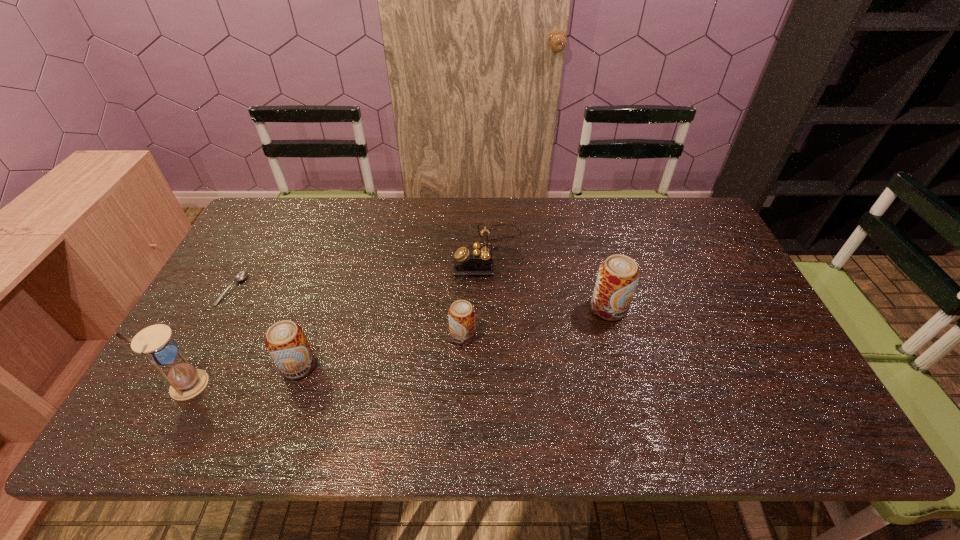
Locate an element on the screen. beer can that is the second closest to the fourth object from right to left is located at coordinates click(618, 275).

What are the coordinates of `vacant space that satisfies the following two spatial constraints: 1. on the back side of the fifth shortest object; 2. on the left side of the tallest object` in the screenshot? It's located at (227, 308).

Identify the location of free region that satisfies the following two spatial constraints: 1. on the back side of the rightmost object; 2. on the dial of the telephone. point(593,252).

Identify the location of free space that satisfies the following two spatial constraints: 1. on the dial of the telephone; 2. on the right side of the rightmost beer can. The width and height of the screenshot is (960, 540). (491, 308).

Identify the location of vacant region that satisfies the following two spatial constraints: 1. on the back side of the fourth object from right to left; 2. on the left side of the rightmost beer can. (319, 308).

Where is `free region that satisfies the following two spatial constraints: 1. on the dial of the telephone; 2. on the left side of the farthest beer can`? free region that satisfies the following two spatial constraints: 1. on the dial of the telephone; 2. on the left side of the farthest beer can is located at coordinates (491, 308).

What are the coordinates of `free location that satisfies the following two spatial constraints: 1. on the dial of the telephone; 2. on the right side of the fifth shortest object` in the screenshot? It's located at (491, 308).

You are a GUI agent. You are given a task and a screenshot of the screen. Output one action in this format:
    pyautogui.click(x=<x>, y=<y>)
    Task: Click on the free region that satisfies the following two spatial constraints: 1. on the dial of the telephone; 2. on the front side of the second farthest beer can
    The image size is (960, 540).
    Given the screenshot: What is the action you would take?
    pyautogui.click(x=491, y=336)